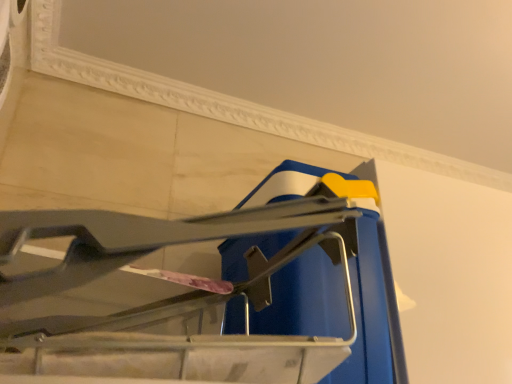
Based on the photo, in order to face white textured wall at upper center, should I rotate leftwards or rightwards?

You should look right and rotate roughly 16.987 degrees.

In order to click on white textured wall at upper center in this screenshot , I will do `click(229, 105)`.

What do you see at coordinates (229, 105) in the screenshot?
I see `white textured wall at upper center` at bounding box center [229, 105].

What do you see at coordinates (209, 290) in the screenshot?
I see `blue plastic bucket at center` at bounding box center [209, 290].

Locate an element on the screen. This screenshot has width=512, height=384. blue plastic bucket at center is located at coordinates (209, 290).

The height and width of the screenshot is (384, 512). In order to click on white textured wall at upper center in this screenshot , I will do `click(229, 105)`.

Which is more to the right, blue plastic bucket at center or white textured wall at upper center?

From the viewer's perspective, white textured wall at upper center appears more on the right side.

Is blue plastic bucket at center in front of white textured wall at upper center?

Yes, the depth of blue plastic bucket at center is less than that of white textured wall at upper center.

Is point (5, 331) positioned in front of point (159, 77)?

Yes, it is.

From the image's perspective, is blue plastic bucket at center above white textured wall at upper center?

No, from the image's perspective, blue plastic bucket at center is not over white textured wall at upper center.

Looking at this image, from a real-world perspective, is blue plastic bucket at center positioned under white textured wall at upper center based on gravity?

Yes, from a real-world perspective, blue plastic bucket at center is under white textured wall at upper center.

Which of these two, blue plastic bucket at center or white textured wall at upper center, is thinner?

Thinner between the two is blue plastic bucket at center.

Is blue plastic bucket at center shorter than white textured wall at upper center?

No, blue plastic bucket at center is not shorter than white textured wall at upper center.

Looking at this image, which of these two, blue plastic bucket at center or white textured wall at upper center, is bigger?

blue plastic bucket at center is bigger.

Can white textured wall at upper center be found inside blue plastic bucket at center?

No, white textured wall at upper center is located outside of blue plastic bucket at center.

In the scene shown: Is blue plastic bucket at center placed right next to white textured wall at upper center?

No, blue plastic bucket at center is not next to white textured wall at upper center.

Could you tell me if blue plastic bucket at center is facing white textured wall at upper center?

No, blue plastic bucket at center is not aimed at white textured wall at upper center.

Image resolution: width=512 pixels, height=384 pixels. Identify the location of window frame that appears above the blue plastic bucket at center (from a real-world perspective). (229, 105).

Consider the image. In the image, is white textured wall at upper center on the left side or the right side of blue plastic bucket at center?

white textured wall at upper center is to the right of blue plastic bucket at center.

Based on the photo, which object is closer to the camera, white textured wall at upper center or blue plastic bucket at center?

Positioned in front is blue plastic bucket at center.

Is point (69, 61) closer or farther from the camera than point (253, 242)?

Point (69, 61).

From the image's perspective, which object appears higher, white textured wall at upper center or blue plastic bucket at center?

white textured wall at upper center, from the image's perspective.

From a real-world perspective, is white textured wall at upper center physically above blue plastic bucket at center?

Indeed, from a real-world perspective, white textured wall at upper center stands above blue plastic bucket at center.

Considering the sizes of white textured wall at upper center and blue plastic bucket at center in the image, is white textured wall at upper center wider or thinner than blue plastic bucket at center?

Clearly, white textured wall at upper center has more width compared to blue plastic bucket at center.

Can you confirm if white textured wall at upper center is shorter than blue plastic bucket at center?

Correct, white textured wall at upper center is not as tall as blue plastic bucket at center.

Is white textured wall at upper center bigger or smaller than blue plastic bucket at center?

In the image, white textured wall at upper center appears to be smaller than blue plastic bucket at center.

Would you say white textured wall at upper center is inside or outside blue plastic bucket at center?

white textured wall at upper center is outside blue plastic bucket at center.

Is white textured wall at upper center in contact with blue plastic bucket at center?

No, white textured wall at upper center is not touching blue plastic bucket at center.

Is white textured wall at upper center oriented towards blue plastic bucket at center?

No.

How distant is white textured wall at upper center from blue plastic bucket at center?

A distance of 17.86 inches exists between white textured wall at upper center and blue plastic bucket at center.

The image size is (512, 384). Find the location of `furniture that is below the white textured wall at upper center (from the image's perspective)`. furniture that is below the white textured wall at upper center (from the image's perspective) is located at coordinates (209, 290).

At what (x,y) coordinates should I click in order to perform the action: click on furniture located in front of the white textured wall at upper center. Please return your answer as a coordinate pair (x, y). The image size is (512, 384). Looking at the image, I should click on (209, 290).

What are the coordinates of `window frame that appears on the right of blue plastic bucket at center` in the screenshot? It's located at point(229,105).